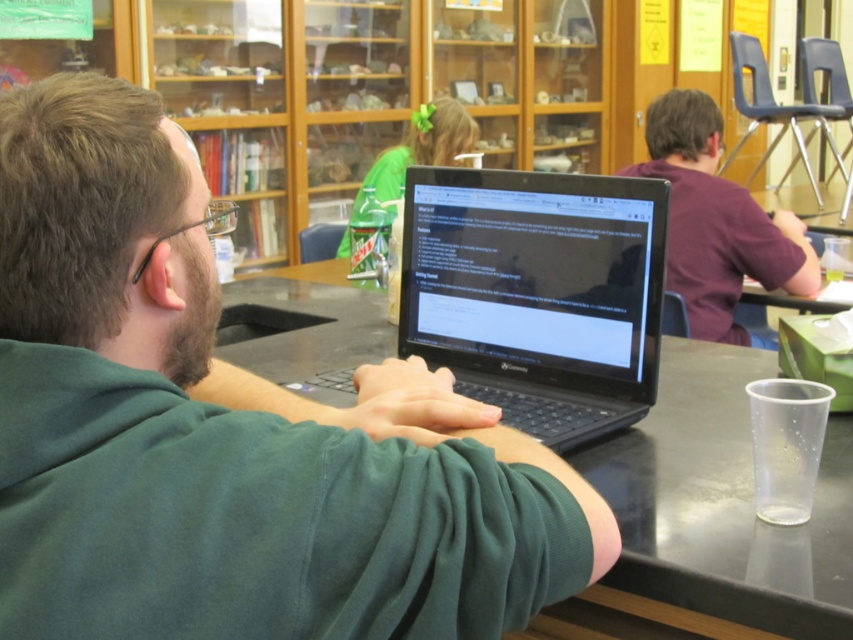
The width and height of the screenshot is (853, 640). What do you see at coordinates (535, 276) in the screenshot? I see `black glossy laptop at center` at bounding box center [535, 276].

Is the position of black glossy laptop at center less distant than that of green fabric hairband at upper center?

Yes.

Identify the location of black glossy laptop at center. (x=535, y=276).

Where is `black glossy laptop at center`? black glossy laptop at center is located at coordinates (535, 276).

Which is above, black plastic table at center or purple matte shirt at upper right?

Positioned higher is purple matte shirt at upper right.

Does black plastic table at center appear on the right side of purple matte shirt at upper right?

In fact, black plastic table at center is to the left of purple matte shirt at upper right.

I want to click on black plastic table at center, so click(x=722, y=508).

Does purple matte shirt at upper right appear on the right side of green fabric hairband at upper center?

Correct, you'll find purple matte shirt at upper right to the right of green fabric hairband at upper center.

Is purple matte shirt at upper right shorter than green fabric hairband at upper center?

No.

The image size is (853, 640). What do you see at coordinates (717, 220) in the screenshot?
I see `purple matte shirt at upper right` at bounding box center [717, 220].

Locate an element on the screen. The height and width of the screenshot is (640, 853). purple matte shirt at upper right is located at coordinates (717, 220).